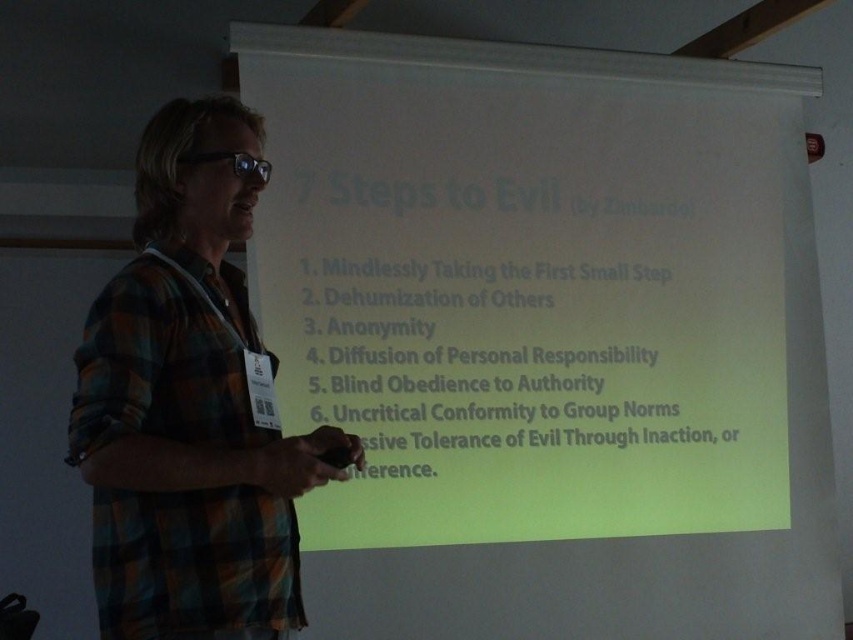
Based on the photo, who is more forward, (328, 493) or (195, 337)?

Point (195, 337) is more forward.

The width and height of the screenshot is (853, 640). What do you see at coordinates (526, 284) in the screenshot?
I see `white matte projection screen at center` at bounding box center [526, 284].

Locate an element on the screen. The width and height of the screenshot is (853, 640). white matte projection screen at center is located at coordinates (526, 284).